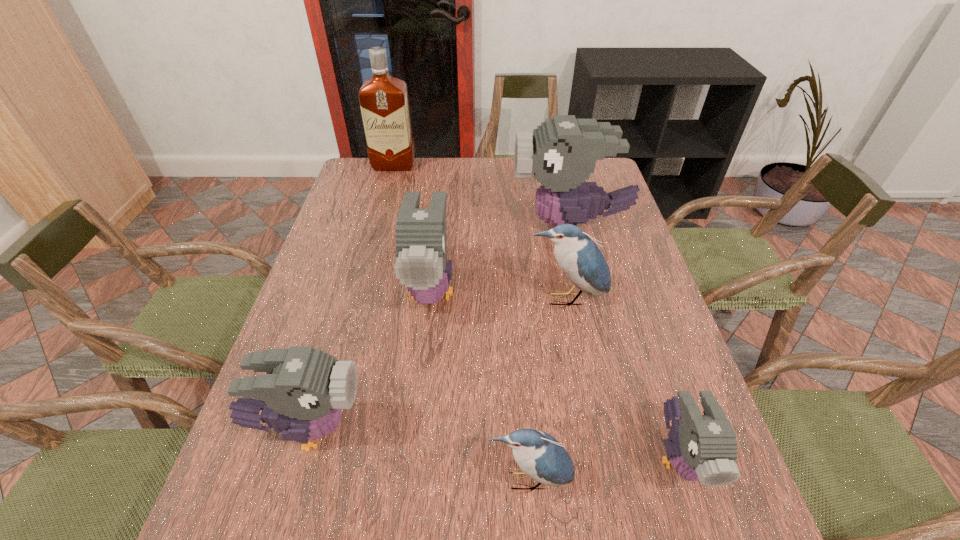
At what (x,y) coordinates should I click in order to perform the action: click on blank region between the bigger blue bird and the smallest gray bird. Please return your answer as a coordinate pair (x, y). The image size is (960, 540). Looking at the image, I should click on (622, 379).

Locate an element on the screen. This screenshot has width=960, height=540. free space between the third smallest gray bird and the farther blue bird is located at coordinates (498, 295).

Locate an element on the screen. Image resolution: width=960 pixels, height=540 pixels. free space that is in between the liquor and the smallest gray bird is located at coordinates (537, 312).

In order to click on vacant area that lies between the liquor and the bigger blue bird in this screenshot , I will do `click(480, 233)`.

Image resolution: width=960 pixels, height=540 pixels. Find the location of `vacant region between the tallest bird and the leftmost gray bird`. vacant region between the tallest bird and the leftmost gray bird is located at coordinates (439, 328).

Identify which object is located as the third nearest to the smaller blue bird. Please provide its 2D coordinates. Your answer should be formatted as a tuple, i.e. [(x, y)], where the tuple contains the x and y coordinates of a point satisfying the conditions above.

[(421, 240)]

I want to click on object that is the third closest one to the tallest object, so click(580, 259).

This screenshot has height=540, width=960. What are the coordinates of `bird that stands as the fifth closest to the smallest gray bird` in the screenshot? It's located at (302, 395).

You are a GUI agent. You are given a task and a screenshot of the screen. Output one action in this format:
    pyautogui.click(x=<x>, y=<y>)
    Task: Click on the bird that is the second closest to the second smallest gray bird
    This screenshot has height=540, width=960.
    Given the screenshot: What is the action you would take?
    pyautogui.click(x=539, y=455)

Choose which gray bird is the nearest neighbor to the third smallest gray bird. Please provide its 2D coordinates. Your answer should be formatted as a tuple, i.e. [(x, y)], where the tuple contains the x and y coordinates of a point satisfying the conditions above.

[(562, 152)]